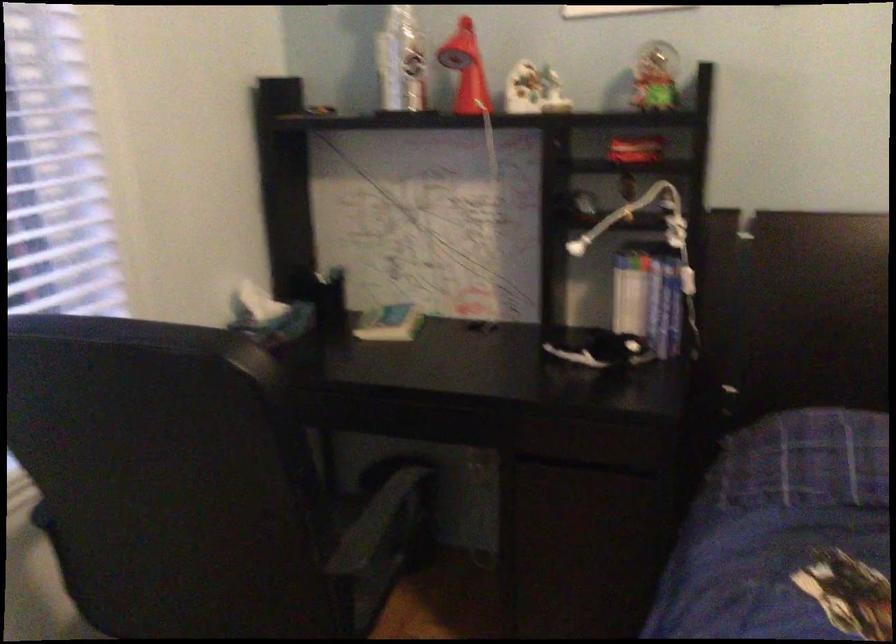
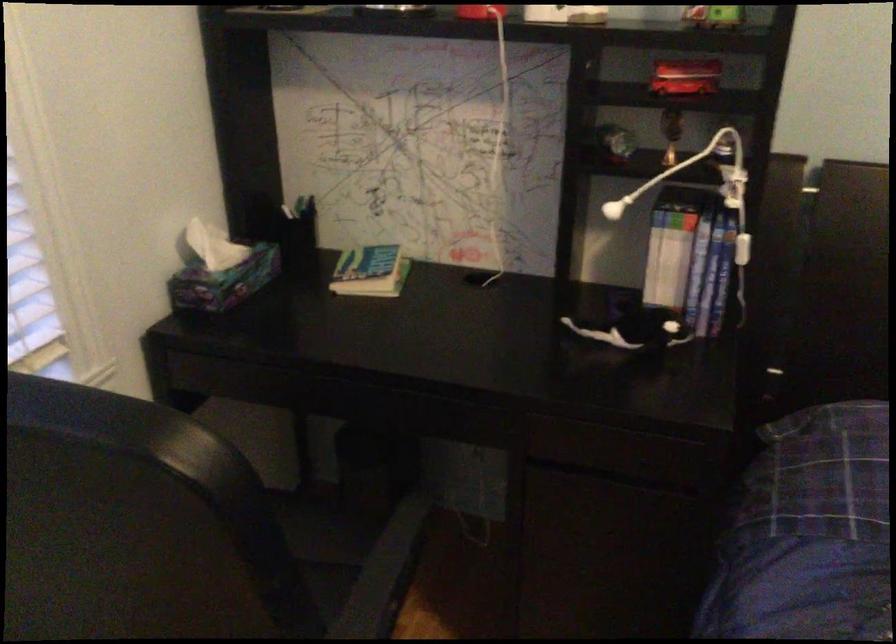
Where in the second image is the point corresponding to (388,319) from the first image?

(371, 270)